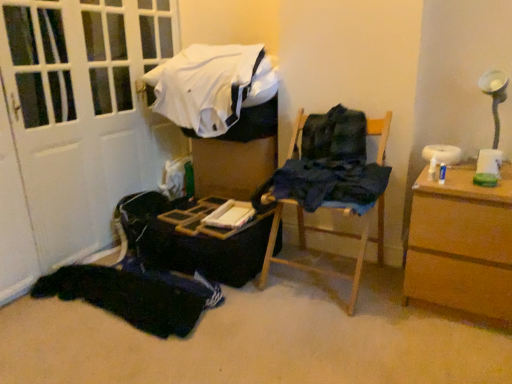
Question: Is white cotton shirt at upper center, the 1th clothing from the top, taller than dark blue fabric at center, the second clothing from the top?

Choices:
 (A) yes
 (B) no

Answer: (A)

Question: Is white cotton shirt at upper center, acting as the 3th clothing starting from the bottom, positioned far away from dark blue fabric at center, acting as the 2th clothing starting from the bottom?

Choices:
 (A) yes
 (B) no

Answer: (B)

Question: Is white cotton shirt at upper center, acting as the 3th clothing starting from the bottom, positioned behind dark blue fabric at center, acting as the 2th clothing starting from the bottom?

Choices:
 (A) no
 (B) yes

Answer: (B)

Question: Considering the relative positions of white cotton shirt at upper center, acting as the 3th clothing starting from the bottom, and dark blue fabric at center, the second clothing from the top, in the image provided, is white cotton shirt at upper center, acting as the 3th clothing starting from the bottom, to the right of dark blue fabric at center, the second clothing from the top, from the viewer's perspective?

Choices:
 (A) no
 (B) yes

Answer: (A)

Question: Does white cotton shirt at upper center, the 1th clothing from the top, have a greater width compared to dark blue fabric at center, the second clothing from the top?

Choices:
 (A) yes
 (B) no

Answer: (A)

Question: From a real-world perspective, is dark blue fabric at center, the second clothing from the top, above or below white matte door at left?

Choices:
 (A) above
 (B) below

Answer: (B)

Question: In the image, is dark blue fabric at center, the second clothing from the top, positioned in front of or behind white matte door at left?

Choices:
 (A) behind
 (B) front

Answer: (A)

Question: From the image's perspective, is dark blue fabric at center, the second clothing from the top, positioned above or below white matte door at left?

Choices:
 (A) above
 (B) below

Answer: (B)

Question: Visually, is dark blue fabric at center, the second clothing from the top, positioned to the left or to the right of white matte door at left?

Choices:
 (A) right
 (B) left

Answer: (A)

Question: In terms of width, does black fabric at lower left, which appears as the 3th clothing when viewed from the top, look wider or thinner when compared to white cotton shirt at upper center, acting as the 3th clothing starting from the bottom?

Choices:
 (A) thin
 (B) wide

Answer: (B)

Question: Is black fabric at lower left, placed as the 1th clothing when sorted from bottom to top, inside the boundaries of white cotton shirt at upper center, acting as the 3th clothing starting from the bottom, or outside?

Choices:
 (A) outside
 (B) inside

Answer: (A)

Question: In terms of height, does black fabric at lower left, placed as the 1th clothing when sorted from bottom to top, look taller or shorter compared to white cotton shirt at upper center, the 1th clothing from the top?

Choices:
 (A) short
 (B) tall

Answer: (A)

Question: In the image, is black fabric at lower left, placed as the 1th clothing when sorted from bottom to top, on the left side or the right side of white cotton shirt at upper center, the 1th clothing from the top?

Choices:
 (A) left
 (B) right

Answer: (A)

Question: Based on their positions, is wooden chair at center located to the left or right of black fabric at lower left, which appears as the 3th clothing when viewed from the top?

Choices:
 (A) right
 (B) left

Answer: (A)

Question: In the image, is wooden chair at center positioned in front of or behind black fabric at lower left, which appears as the 3th clothing when viewed from the top?

Choices:
 (A) front
 (B) behind

Answer: (A)